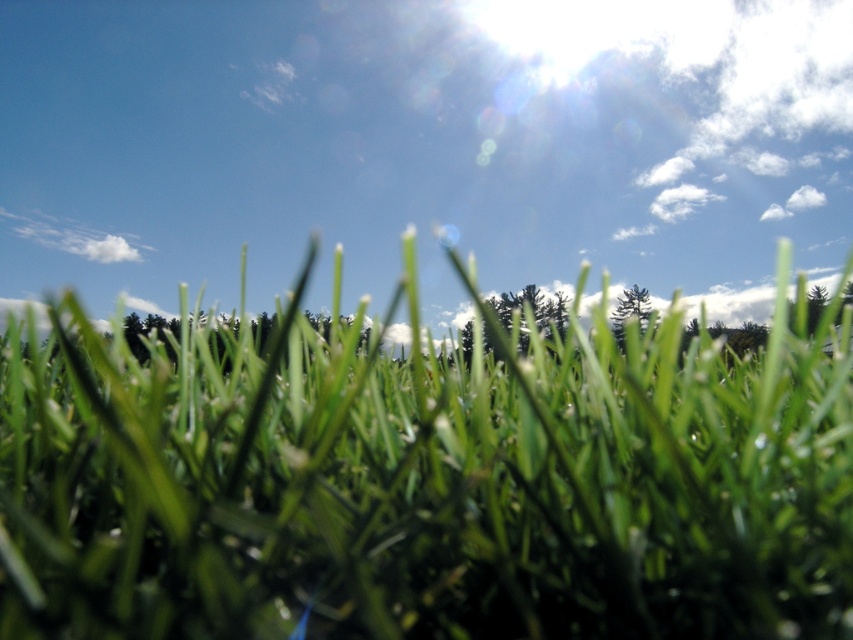
You are a gardener planning to plant two green matte trees in your backyard. You observe the image and notice the green matte tree at center and the green matte tree at upper center. Which tree has a wider base?

The green matte tree at center has a wider base than the green matte tree at upper center, as its width surpasses the latter.

You are standing in the middle of the grassy area and looking towards the green matte tree at upper center. There is a green matte tree at center blocking your view. Which tree is closer to you?

The green matte tree at center is closer to you, as it is positioned in front of the green matte tree at upper center.

You are standing at the center of the image and want to place a small garden ornament exactly at the coordinates mentioned in the green grass at center. What are the coordinates where you should place it?

The green grass at center is located at point (425, 483), so you should place the ornament at those coordinates.